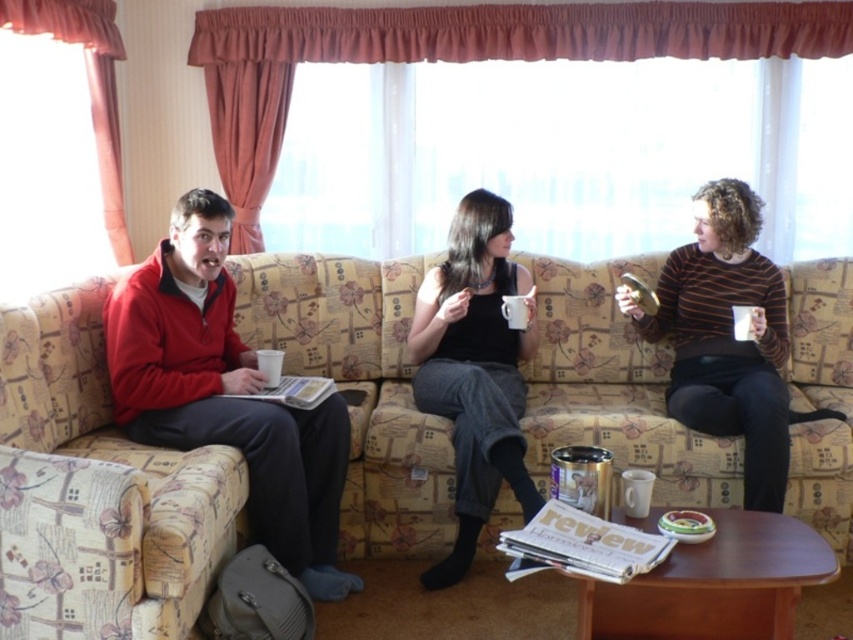
Between striped sweater at right and matte black tank top at center, which one appears on the left side from the viewer's perspective?

Positioned to the left is matte black tank top at center.

Does striped sweater at right have a greater height compared to matte black tank top at center?

No, striped sweater at right is not taller than matte black tank top at center.

Find the location of a particular element. striped sweater at right is located at coordinates (724, 337).

Based on the photo, between matte red sweater at left and striped sweater at right, which one has less height?

With less height is striped sweater at right.

Is matte red sweater at left smaller than striped sweater at right?

Actually, matte red sweater at left might be larger than striped sweater at right.

Image resolution: width=853 pixels, height=640 pixels. Find the location of `matte red sweater at left`. matte red sweater at left is located at coordinates (225, 394).

Does matte red sweater at left come behind matte black tank top at center?

No, matte red sweater at left is closer to the viewer.

Identify the location of matte red sweater at left. (225, 394).